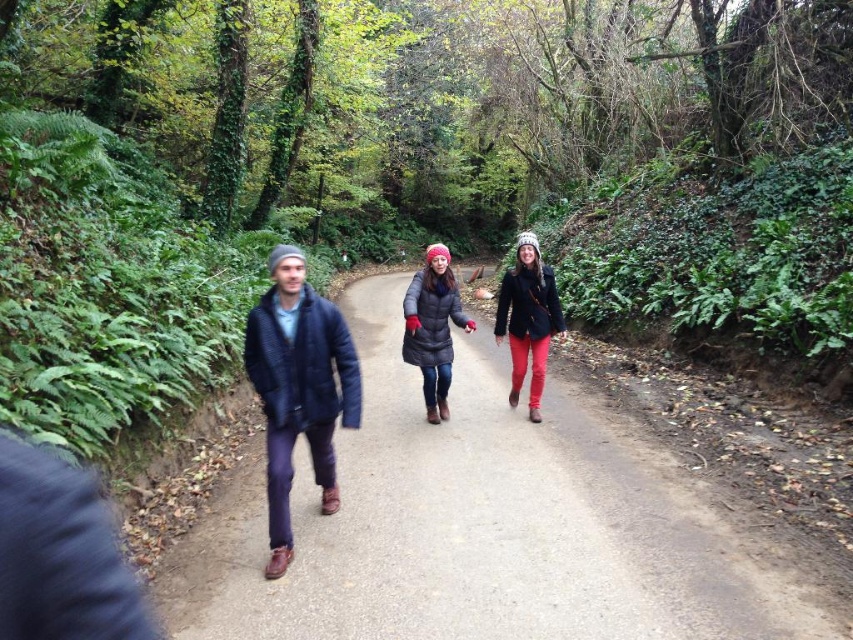
You are a photographer trying to capture a photo of the dark blue quilted jacket at center and the matte black coat at center. Since the path is narrow, you can only focus on one person at a time. Which jacket should you focus on to ensure the other is still visible in the background?

The dark blue quilted jacket at center is positioned under the matte black coat at center. Therefore, focusing on the matte black coat at center will allow the dark blue quilted jacket at center to be visible in the background since it is behind.

You are a hiker standing at the start of a forest path. You see a dark blue quilted jacket at center ahead of you. Can you safely walk towards it without needing to turn around?

The dark blue quilted jacket at center is 4.01 meters away from you, so yes, you can safely walk towards it without needing to turn around since the distance is manageable for a hiker to cover.